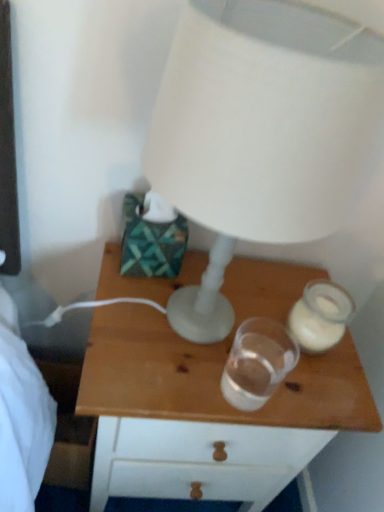
You are a GUI agent. You are given a task and a screenshot of the screen. Output one action in this format:
    pyautogui.click(x=<x>, y=<y>)
    Task: Click on the free space to the left of translucent glass candle holder at right, the first candle holder in the right-to-left sequence
    The height and width of the screenshot is (512, 384).
    Given the screenshot: What is the action you would take?
    pyautogui.click(x=225, y=326)